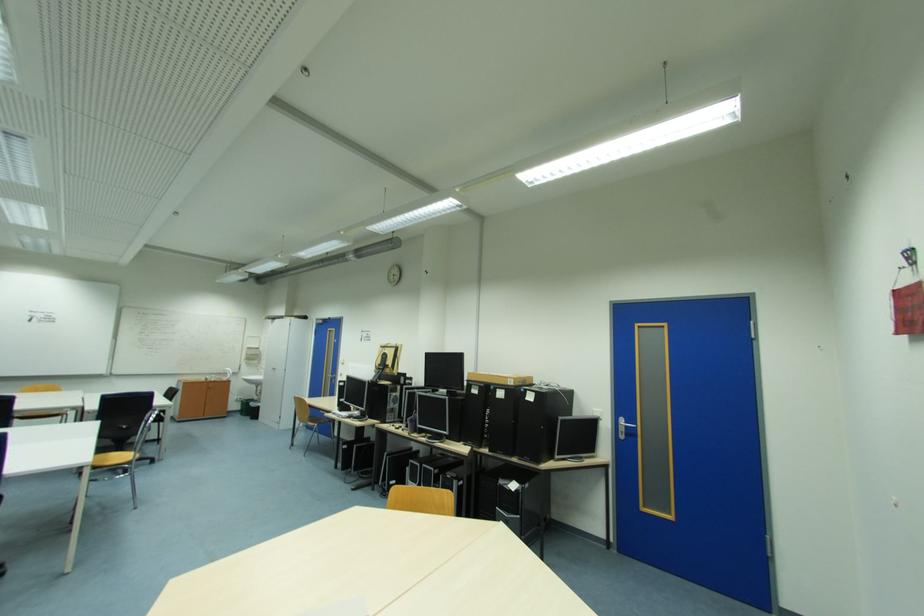
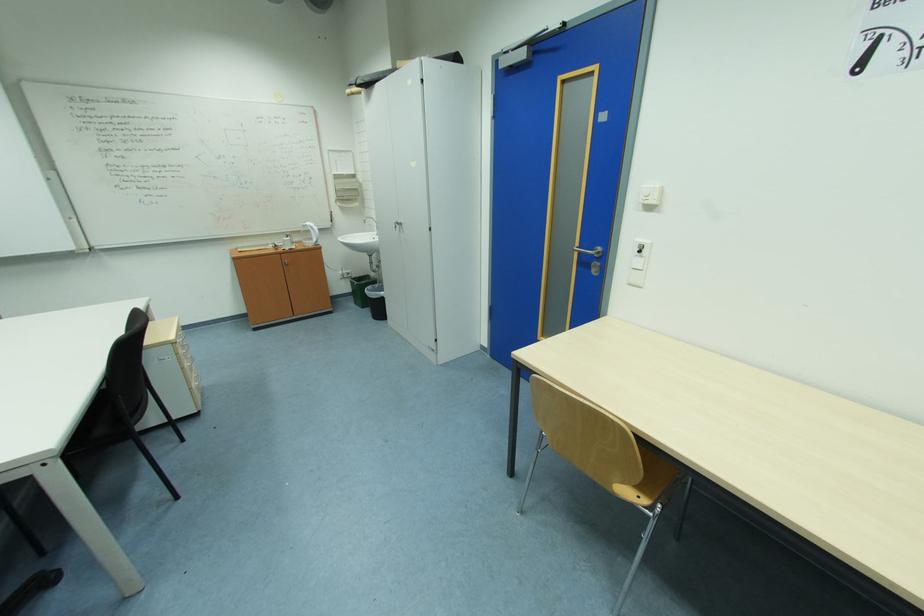
In the second image, find the point that corresponds to pixel 252 416 in the first image.

(370, 309)